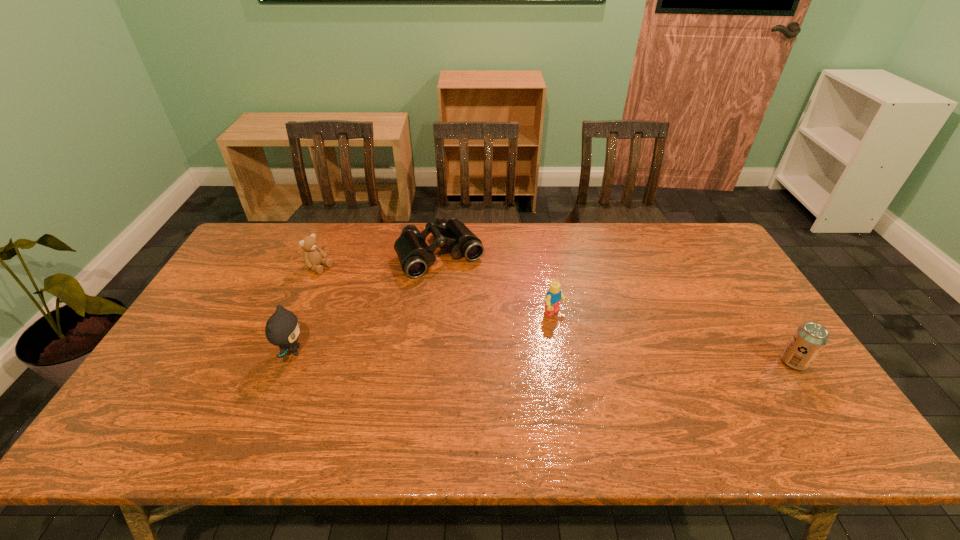
At what (x,y) coordinates should I click in order to perform the action: click on free space located on the front-facing side of the binoculars. Please return your answer as a coordinate pair (x, y). This screenshot has height=540, width=960. Looking at the image, I should click on (512, 358).

Locate an element on the screen. vacant space located 0.160m on the front-facing side of the Lego is located at coordinates (610, 354).

Find the location of a particular element. This screenshot has height=540, width=960. free space located 0.280m on the front-facing side of the Lego is located at coordinates (649, 383).

Image resolution: width=960 pixels, height=540 pixels. Identify the location of vacant point located 0.210m on the front-facing side of the Lego. (625, 365).

This screenshot has height=540, width=960. I want to click on free spot located on the face of the teddy bear, so click(397, 308).

Locate an element on the screen. Image resolution: width=960 pixels, height=540 pixels. free space located on the face of the teddy bear is located at coordinates (408, 314).

Locate an element on the screen. This screenshot has width=960, height=540. free location located on the face of the teddy bear is located at coordinates (379, 299).

Locate an element on the screen. Image resolution: width=960 pixels, height=540 pixels. binoculars that is at the far edge is located at coordinates (414, 254).

Image resolution: width=960 pixels, height=540 pixels. Find the location of `teddy bear at the far edge`. teddy bear at the far edge is located at coordinates (313, 256).

Find the location of a particular element. The width and height of the screenshot is (960, 540). object present at the right edge is located at coordinates (809, 339).